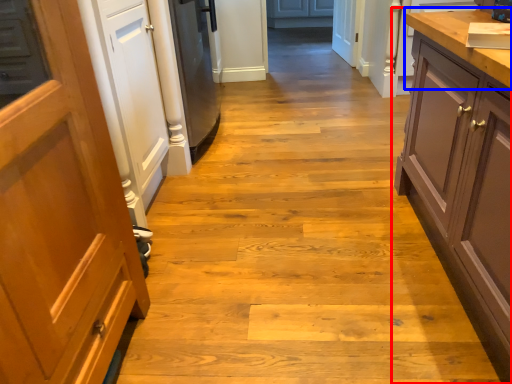
Question: Which object is further to the camera taking this photo, cabinetry (highlighted by a red box) or countertop (highlighted by a blue box)?

Choices:
 (A) cabinetry
 (B) countertop

Answer: (B)